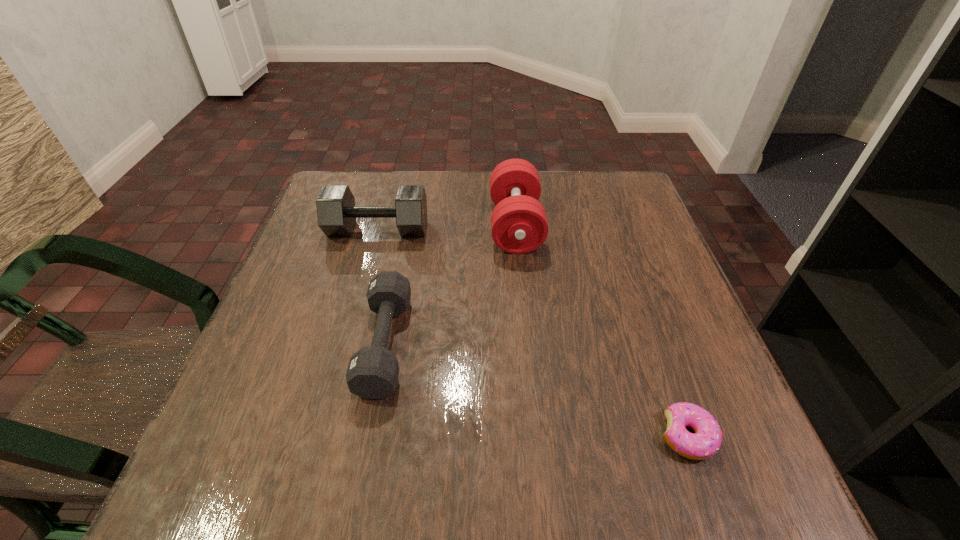
Identify the location of vacant space at the near right corner. (667, 449).

Locate an element on the screen. empty space between the second object from right to left and the second shortest dumbbell is located at coordinates (446, 227).

Where is `free space between the third object from left to right and the second tallest dumbbell`? free space between the third object from left to right and the second tallest dumbbell is located at coordinates (446, 227).

Locate an element on the screen. The image size is (960, 540). free space that is in between the second object from right to left and the second tallest dumbbell is located at coordinates (446, 227).

At what (x,y) coordinates should I click in order to perform the action: click on free space between the shortest object and the third object from left to right. Please return your answer as a coordinate pair (x, y). The image size is (960, 540). Looking at the image, I should click on (601, 331).

Where is `vacant space that's between the second shortest dumbbell and the rightmost dumbbell`? This screenshot has width=960, height=540. vacant space that's between the second shortest dumbbell and the rightmost dumbbell is located at coordinates (446, 227).

This screenshot has width=960, height=540. I want to click on free area in between the second tallest object and the nearest object, so click(x=533, y=333).

This screenshot has width=960, height=540. Identify the location of the closest object to the second tallest object. (519, 225).

This screenshot has width=960, height=540. I want to click on object that is the third closest to the second tallest object, so click(706, 441).

At what (x,y) coordinates should I click in order to perform the action: click on the second closest dumbbell relative to the second object from right to left. Please return your answer as a coordinate pair (x, y). Image resolution: width=960 pixels, height=540 pixels. Looking at the image, I should click on (372, 373).